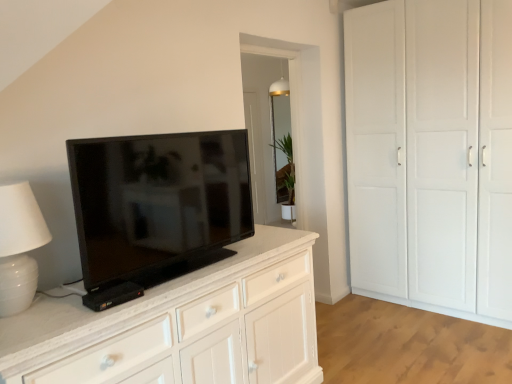
Question: Can you confirm if black glossy tv at center is positioned to the right of white matte cupboard at right?

Choices:
 (A) yes
 (B) no

Answer: (B)

Question: Is black glossy tv at center facing away from white matte cupboard at right?

Choices:
 (A) no
 (B) yes

Answer: (A)

Question: Is black glossy tv at center positioned beyond the bounds of white matte cupboard at right?

Choices:
 (A) no
 (B) yes

Answer: (B)

Question: Is black glossy tv at center taller than white matte cupboard at right?

Choices:
 (A) yes
 (B) no

Answer: (B)

Question: From the image's perspective, is black glossy tv at center below white matte cupboard at right?

Choices:
 (A) yes
 (B) no

Answer: (A)

Question: Would you say green matte plant at center is inside or outside black glossy tv at center?

Choices:
 (A) inside
 (B) outside

Answer: (B)

Question: Considering the positions of green matte plant at center and black glossy tv at center in the image, is green matte plant at center bigger or smaller than black glossy tv at center?

Choices:
 (A) small
 (B) big

Answer: (B)

Question: From the image's perspective, is green matte plant at center positioned above or below black glossy tv at center?

Choices:
 (A) above
 (B) below

Answer: (A)

Question: Looking at their shapes, would you say green matte plant at center is wider or thinner than black glossy tv at center?

Choices:
 (A) wide
 (B) thin

Answer: (A)

Question: Is black glossy tv at center taller or shorter than white matte cupboard at right?

Choices:
 (A) tall
 (B) short

Answer: (B)

Question: From the image's perspective, is black glossy tv at center above or below white matte cupboard at right?

Choices:
 (A) below
 (B) above

Answer: (A)

Question: In terms of size, does black glossy tv at center appear bigger or smaller than white matte cupboard at right?

Choices:
 (A) small
 (B) big

Answer: (A)

Question: From a real-world perspective, is black glossy tv at center physically located above or below white matte cupboard at right?

Choices:
 (A) above
 (B) below

Answer: (A)

Question: Based on their positions, is white ceramic table lamp at left located to the left or right of green matte plant at center?

Choices:
 (A) left
 (B) right

Answer: (A)

Question: Looking at the image, does white ceramic table lamp at left seem bigger or smaller compared to green matte plant at center?

Choices:
 (A) small
 (B) big

Answer: (A)